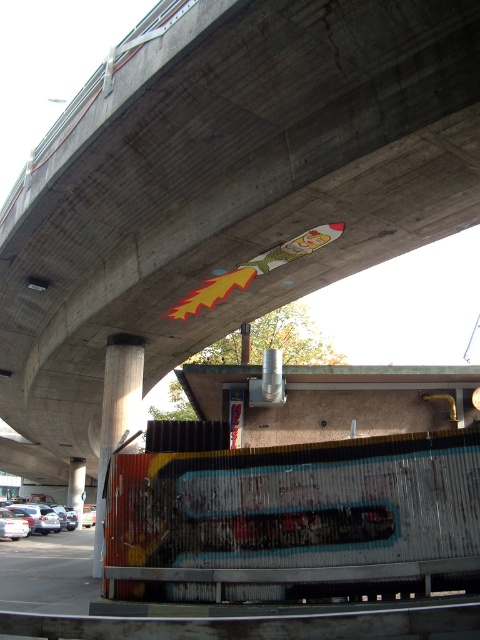
Does rusty metal pillar at lower left appear over silver metallic car at lower left?

Yes, rusty metal pillar at lower left is above silver metallic car at lower left.

This screenshot has width=480, height=640. What do you see at coordinates (117, 417) in the screenshot?
I see `rusty metal pillar at lower left` at bounding box center [117, 417].

Does point (108, 380) lie in front of point (34, 522)?

That is True.

Locate an element on the screen. The image size is (480, 640). rusty metal pillar at lower left is located at coordinates (117, 417).

From the picture: Who is positioned more to the left, silver metallic car at lower left or concrete pillar at center?

From the viewer's perspective, silver metallic car at lower left appears more on the left side.

Is point (45, 512) positioned behind point (75, 500)?

That is False.

Is point (48, 506) positioned behind point (78, 472)?

That is False.

Locate an element on the screen. silver metallic car at lower left is located at coordinates (44, 516).

Looking at this image, is rusty metal pillar at lower left to the left of concrete pillar at center from the viewer's perspective?

Incorrect, rusty metal pillar at lower left is not on the left side of concrete pillar at center.

Which is more to the left, rusty metal pillar at lower left or concrete pillar at center?

concrete pillar at center is more to the left.

Which is behind, point (109, 456) or point (79, 465)?

Positioned behind is point (79, 465).

Find the location of a particular element. This screenshot has height=640, width=480. rusty metal pillar at lower left is located at coordinates (117, 417).